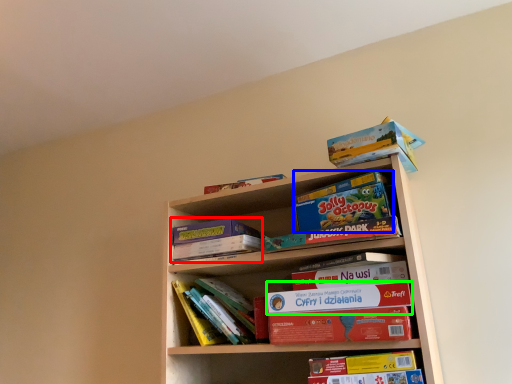
Question: Based on their relative distances, which object is nearer to paperback book (highlighted by a red box)? Choose from paperback book (highlighted by a blue box) and paperback book (highlighted by a green box).

Choices:
 (A) paperback book
 (B) paperback book

Answer: (B)